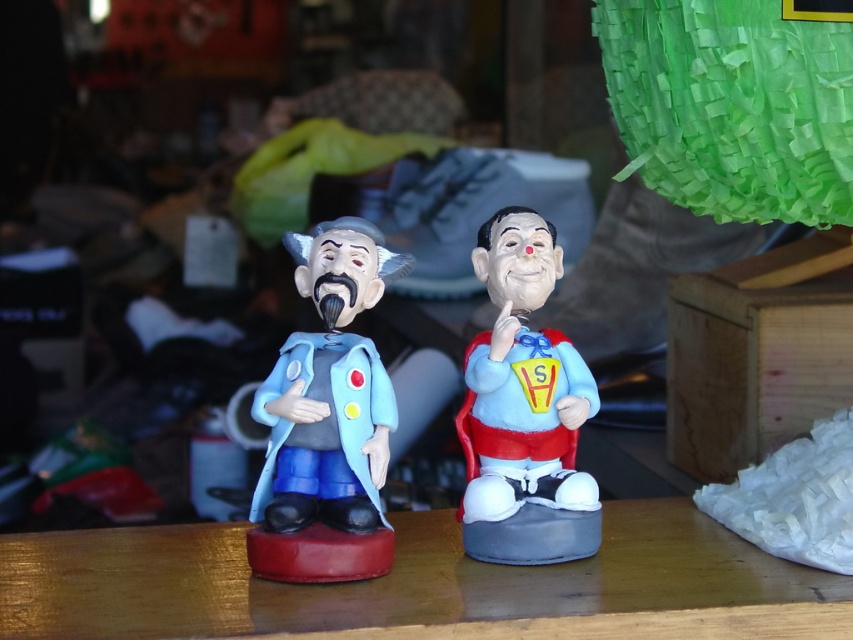
Question: Among these points, which one is nearest to the camera?

Choices:
 (A) (373, 228)
 (B) (577, 628)

Answer: (B)

Question: Among these points, which one is farthest from the camera?

Choices:
 (A) (457, 429)
 (B) (97, 566)

Answer: (A)

Question: Is wooden table at center below matte plastic clown at center?

Choices:
 (A) yes
 (B) no

Answer: (A)

Question: Which point is farther to the camera?

Choices:
 (A) wooden table at center
 (B) matte clay figurine at center

Answer: (B)

Question: Is wooden table at center above matte clay figurine at center?

Choices:
 (A) yes
 (B) no

Answer: (B)

Question: Does matte clay figurine at center have a greater width compared to matte plastic clown at center?

Choices:
 (A) no
 (B) yes

Answer: (A)